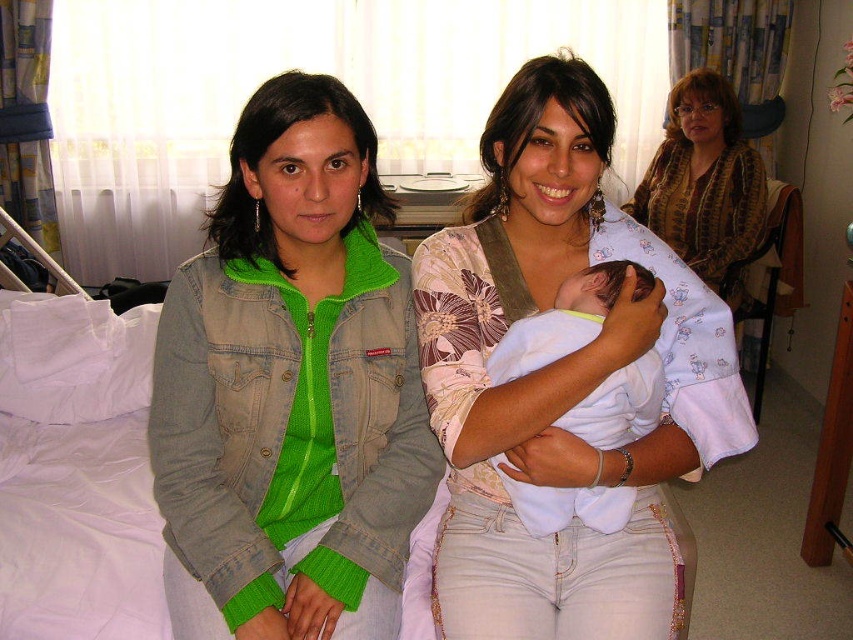
Question: Which point is closer to the camera?

Choices:
 (A) patterned fabric baby at upper right
 (B) white cotton baby at center
 (C) white soft cloth at center

Answer: (B)

Question: Considering the relative positions of green denim jacket at left and patterned fabric baby at upper right in the image provided, where is green denim jacket at left located with respect to patterned fabric baby at upper right?

Choices:
 (A) below
 (B) above

Answer: (A)

Question: Can you confirm if white cotton baby at center is positioned to the left of white soft cloth at center?

Choices:
 (A) yes
 (B) no

Answer: (B)

Question: Which point is farther to the camera?

Choices:
 (A) tap(552, 116)
 (B) tap(210, 438)
 (C) tap(625, 493)

Answer: (B)

Question: Is green denim jacket at left to the left of white cotton baby at center from the viewer's perspective?

Choices:
 (A) no
 (B) yes

Answer: (B)

Question: Estimate the real-world distances between objects in this image. Which object is closer to the white cotton baby at center?

Choices:
 (A) patterned fabric baby at upper right
 (B) white soft cloth at center

Answer: (B)